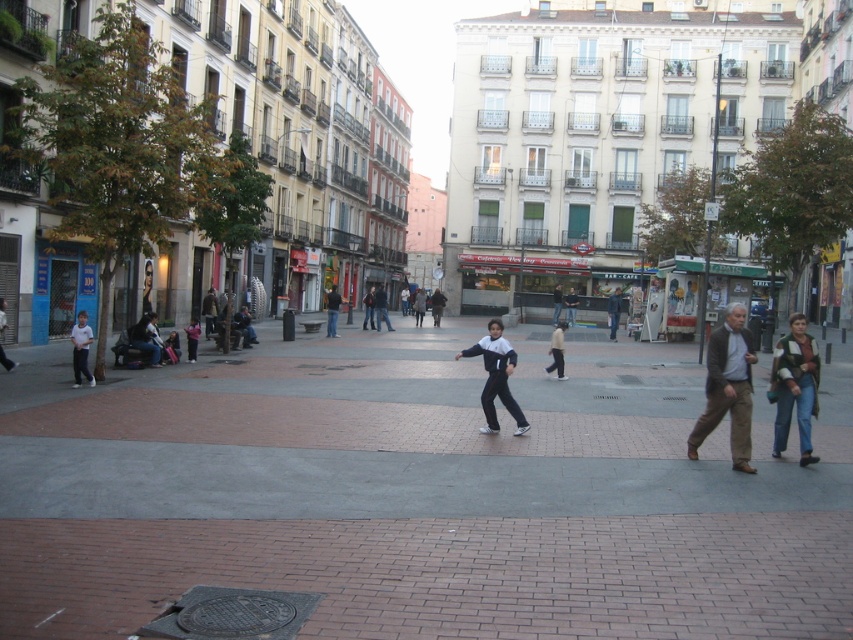
You are a photographer standing in the urban square. You notice the light blue denim pants at center and the dark blue jeans at center. Which pair of pants is shorter in height?

The light blue denim pants at center is not as tall as dark blue jeans at center, so the light blue denim pants at center is shorter in height.

You are a photographer standing in the urban square and want to capture both the brown leather jacket at right and the dark blue jeans at center in the same frame. Which object should you focus on first to ensure both are in focus?

You should focus on the brown leather jacket at right first since it is closer to the viewer than the dark blue jeans at center, allowing both to be in focus when using a shallow depth of field.

You are a photographer standing in the urban square. You want to capture a photo of the brown leather jacket at right and the white and black tracksuit at center. Which one is located to the right of the other?

The brown leather jacket at right is positioned on the right side of white and black tracksuit at center.